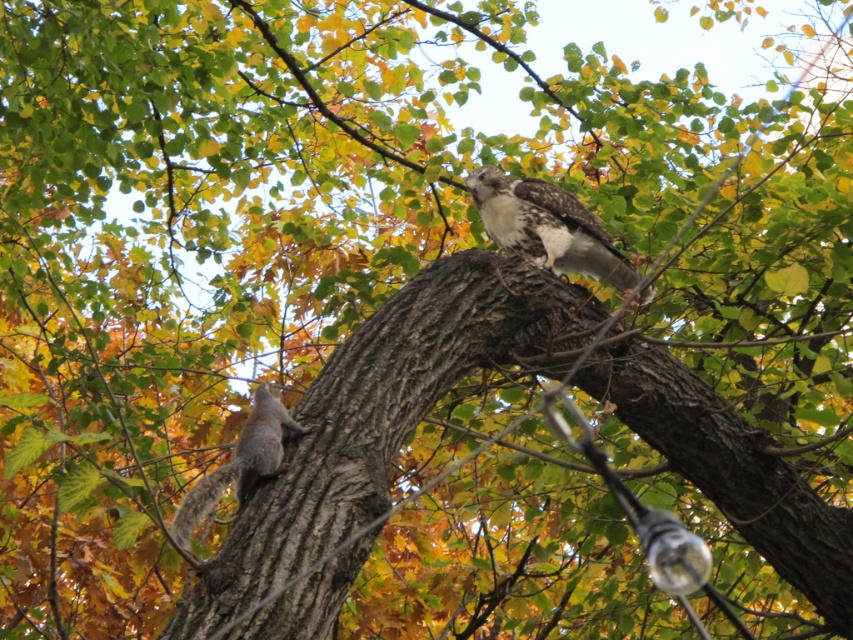
Does brown speckled feathers at upper center come behind gray fur squirrel at lower left?

Yes, it is behind gray fur squirrel at lower left.

Can you confirm if brown speckled feathers at upper center is taller than gray fur squirrel at lower left?

Yes.

Is point (503, 216) behind point (236, 481)?

Yes, it is behind point (236, 481).

I want to click on brown speckled feathers at upper center, so click(546, 227).

From the picture: Can you confirm if brown rough tree trunk at center is positioned above brown speckled feathers at upper center?

No, brown rough tree trunk at center is not above brown speckled feathers at upper center.

Who is lower down, brown rough tree trunk at center or brown speckled feathers at upper center?

brown rough tree trunk at center is below.

Is point (397, 369) in front of point (590, 268)?

That is True.

Identify the location of brown rough tree trunk at center. Image resolution: width=853 pixels, height=640 pixels. (366, 422).

Between brown rough tree trunk at center and gray fur squirrel at lower left, which one has more height?

brown rough tree trunk at center

The height and width of the screenshot is (640, 853). What are the coordinates of `brown rough tree trunk at center` in the screenshot? It's located at (366, 422).

Image resolution: width=853 pixels, height=640 pixels. Find the location of `brown rough tree trunk at center`. brown rough tree trunk at center is located at coordinates (366, 422).

I want to click on brown rough tree trunk at center, so click(366, 422).